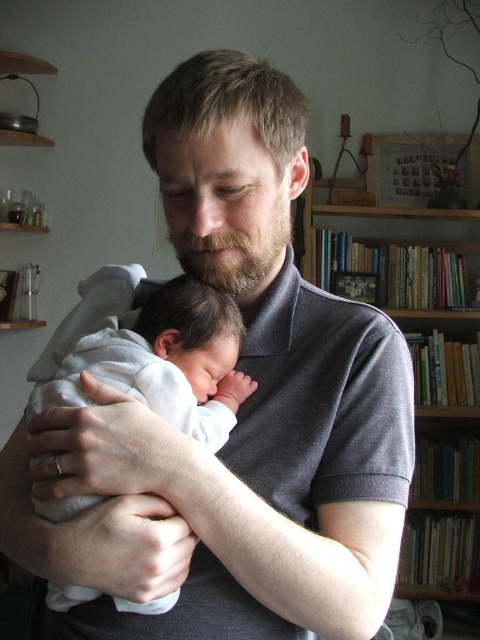
Question: Which object is positioned farthest from the wooden bookshelf at upper right?

Choices:
 (A) brown fuzzy beard at center
 (B) white soft baby at center

Answer: (B)

Question: Does wooden bookshelf at upper right lie behind white soft baby at center?

Choices:
 (A) no
 (B) yes

Answer: (B)

Question: Does wooden bookshelf at upper right appear on the right side of white soft baby at center?

Choices:
 (A) yes
 (B) no

Answer: (A)

Question: Which object is the closest to the white soft baby at center?

Choices:
 (A) wooden bookshelf at upper right
 (B) brown fuzzy beard at center

Answer: (B)

Question: Is white soft baby at center below brown fuzzy beard at center?

Choices:
 (A) no
 (B) yes

Answer: (B)

Question: Which is nearer to the wooden bookshelf at upper right?

Choices:
 (A) brown fuzzy beard at center
 (B) white soft baby at center

Answer: (A)